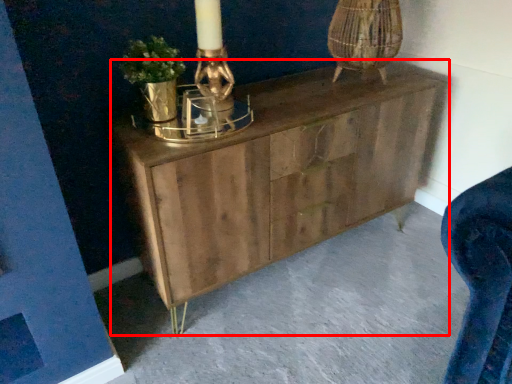
Question: From the image's perspective, where is chest of drawers (annotated by the red box) located in relation to concrete in the image?

Choices:
 (A) below
 (B) above

Answer: (B)